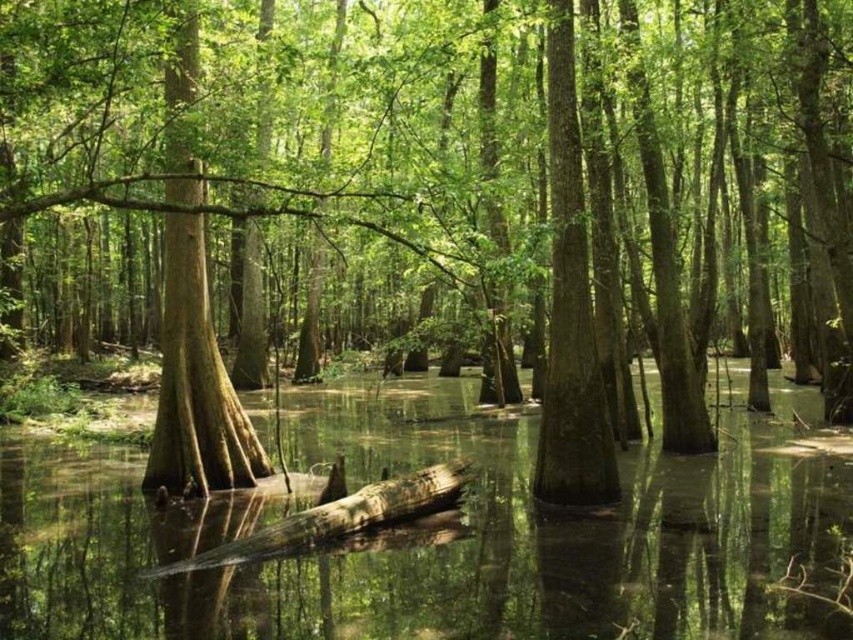
You are standing in the swamp and see the smooth brown tree trunk at center and the brown rough log at center. Which object is positioned to the right side from your viewpoint?

The smooth brown tree trunk at center is to the right of the brown rough log at center, so it is positioned to the right side from your viewpoint.

You are a small animal that needs to jump from the smooth brown tree trunk at center to the brown rough log at center. Can you make the jump if your maximum jump distance is 2.5 meters?

The distance between the smooth brown tree trunk at center and the brown rough log at center is 2.59 meters, which is slightly longer than your maximum jump distance of 2.5 meters. Therefore, you cannot make the jump safely.

You are standing in the swamp scene and want to locate the smooth brown tree trunk at center. According to the coordinates given, where would you look to find it?

The smooth brown tree trunk at center is located at the 2D coordinates point (570,308).